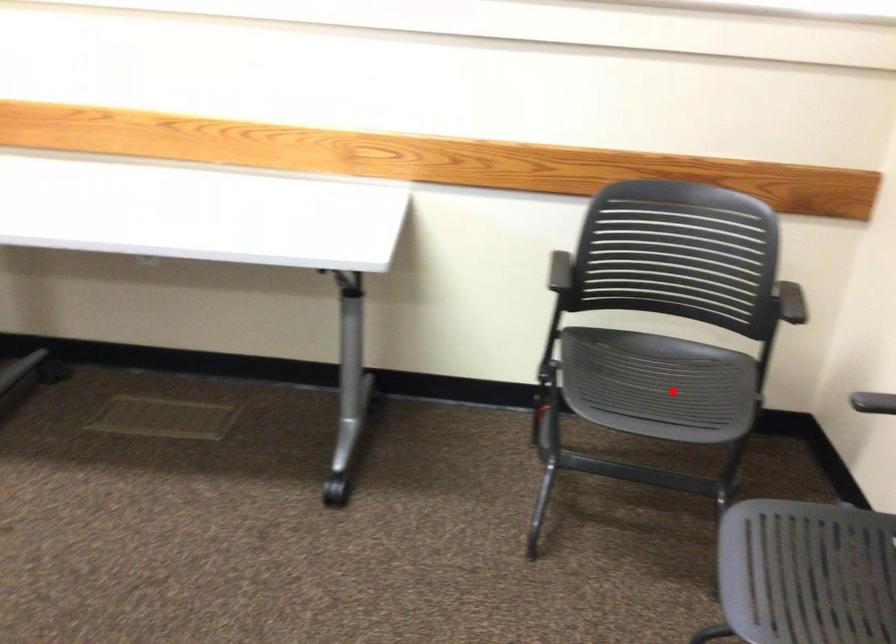
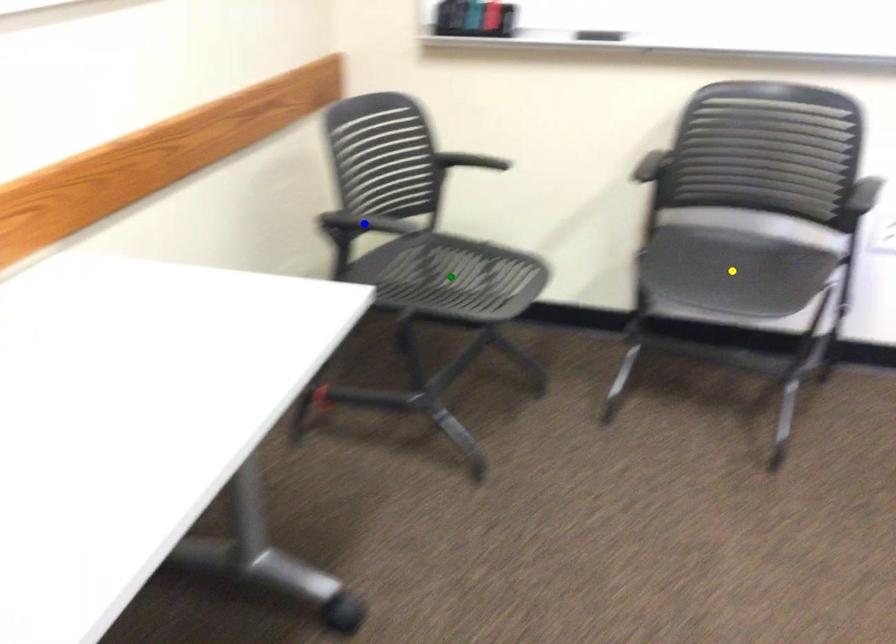
Question: I am providing you with two images of the same scene from different viewpoints. A red point is marked on the first image. You are given multiple points on the second image. Which point in image 2 is actually the same real-world point as the red point in image 1?

Choices:
 (A) green point
 (B) blue point
 (C) yellow point

Answer: (A)